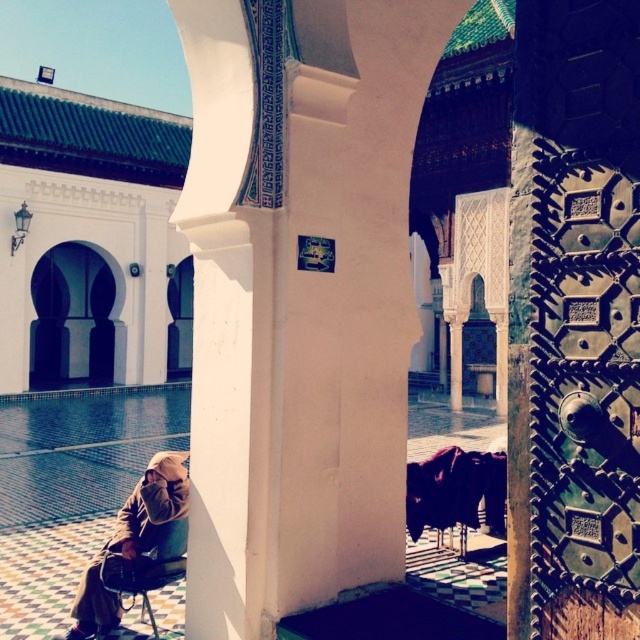
Question: Is brown suede robe at lower left bigger than white stone archway at left?

Choices:
 (A) no
 (B) yes

Answer: (A)

Question: Which object is closer to the camera taking this photo?

Choices:
 (A) white stone archway at left
 (B) brown suede robe at lower left

Answer: (B)

Question: Which object appears farthest from the camera in this image?

Choices:
 (A) brown suede robe at lower left
 (B) white stone archway at left

Answer: (B)

Question: Can you confirm if brown suede robe at lower left is positioned above white stone archway at left?

Choices:
 (A) yes
 (B) no

Answer: (B)

Question: Does brown suede robe at lower left appear over white stone archway at left?

Choices:
 (A) no
 (B) yes

Answer: (A)